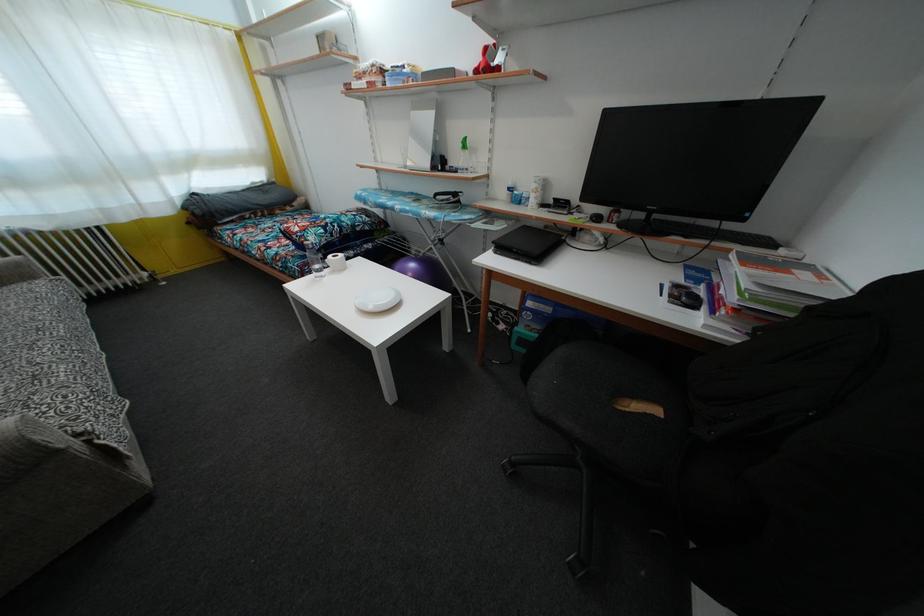
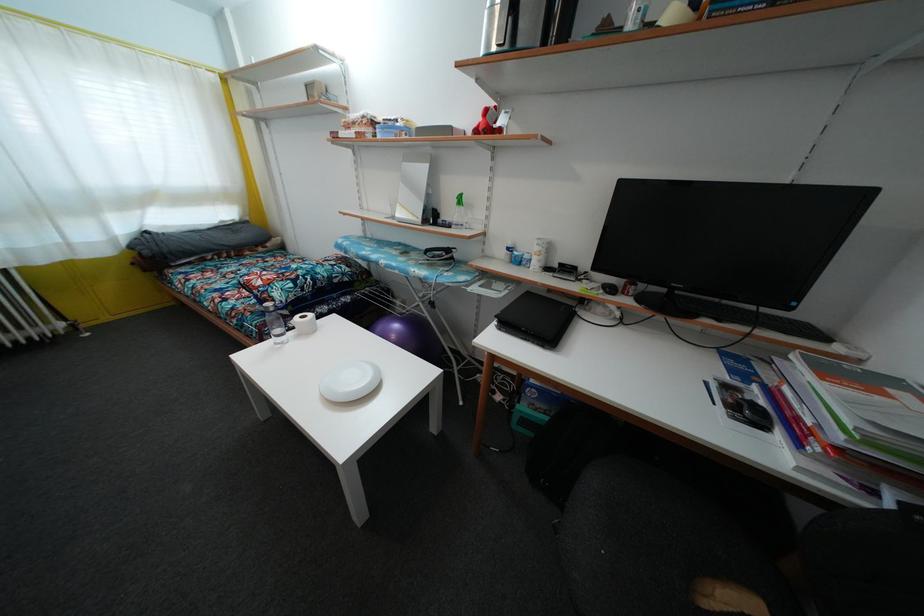
Question: The images are taken continuously from a first-person perspective. In which direction are you moving?

Choices:
 (A) Left
 (B) Right
 (C) Forward
 (D) Backward

Answer: (C)